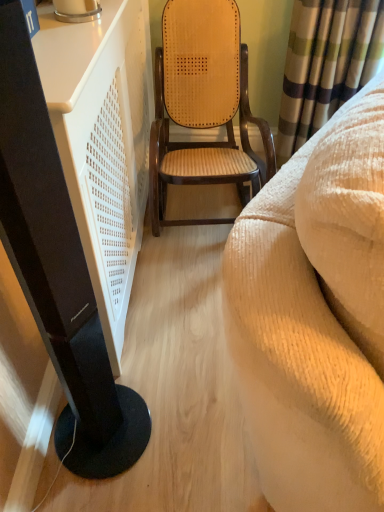
Measure the distance between point (x=19, y=89) and camera.

A distance of 18.66 inches exists between point (x=19, y=89) and camera.

In order to face white glossy table at upper left, should I rotate leftwards or rightwards?

To align with it, rotate left about 17.060°.

Identify the location of white glossy table at upper left. (58, 270).

This screenshot has height=512, width=384. What do you see at coordinates (58, 270) in the screenshot? I see `white glossy table at upper left` at bounding box center [58, 270].

What are the coordinates of `white glossy table at upper left` in the screenshot? It's located at (58, 270).